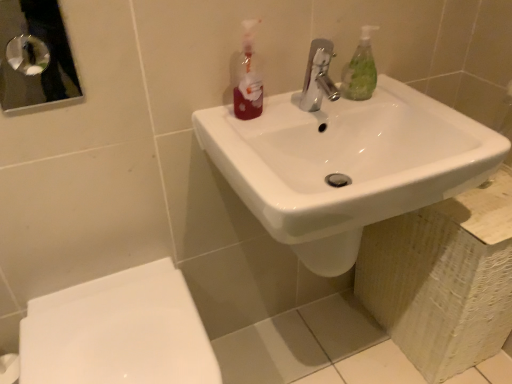
Identify the location of vacant area that lies between green translucent soap dispenser at upper right and translucent plastic bottle at upper center. (308, 107).